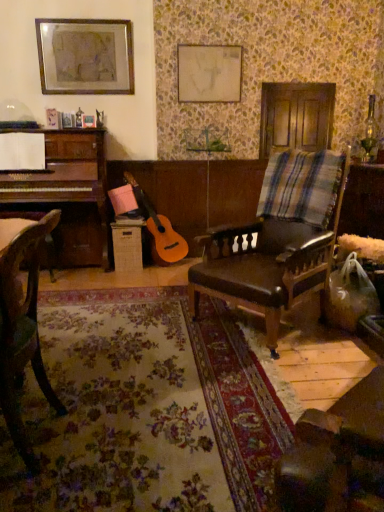
What are the coordinates of `vacant region below brown leather chair at center, which ranks as the second chair in front-to-back order (from a real-world perspective)` in the screenshot? It's located at (285, 326).